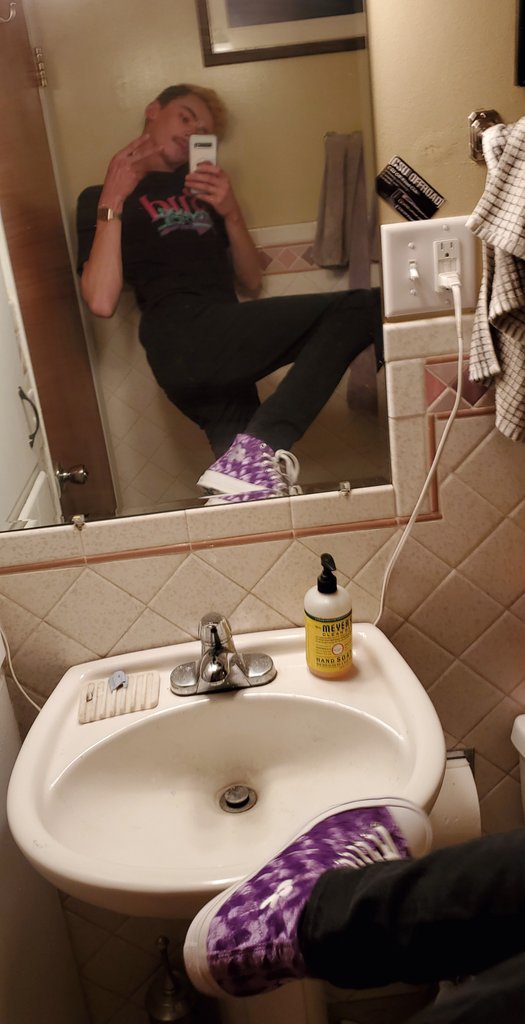
At what (x,y) coordinates should I click in order to perform the action: click on mirror. Please return your answer as a coordinate pair (x, y). The height and width of the screenshot is (1024, 525). Looking at the image, I should click on (342, 394).